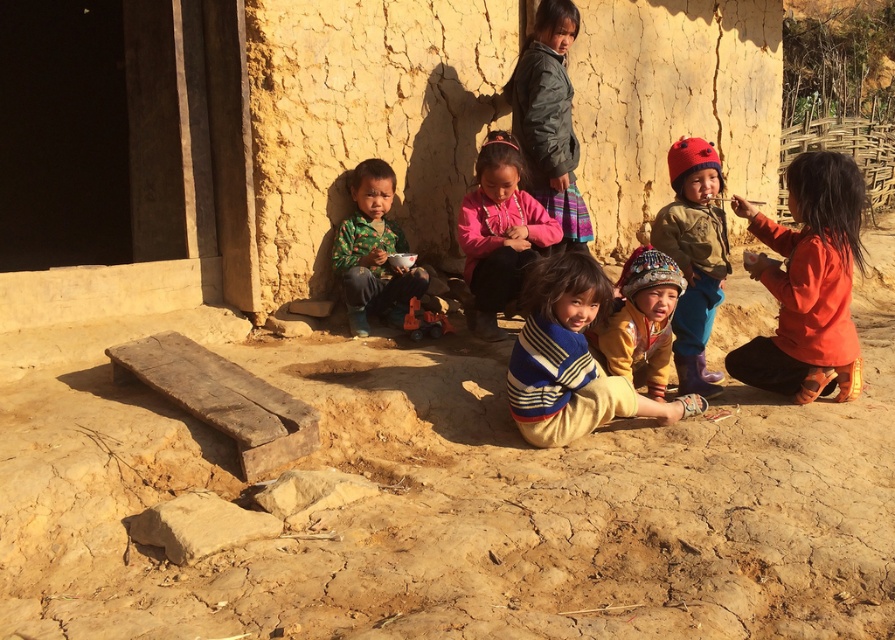
Consider the image. You are a photographer trying to capture the scene of children playing outside a rustic building. You notice a point at coordinates (695, 257). Can you identify what this point corresponds to in the image?

The point at coordinates (695, 257) is on the knitted woolen hat at center.

You are a photographer trying to capture a closeup of the knitted yellow sweater at center without including the brown rough stone at lower left in the frame. Based on their positions, is this possible?

The brown rough stone at lower left is behind the knitted yellow sweater at center, so it is possible to capture a closeup of the knitted yellow sweater at center without including the brown rough stone at lower left in the frame.

You are a photographer trying to capture a group photo of the children wearing the pink fleece jacket at center and the knitted yellow sweater at center. If you want to ensure both children fit in the frame without cropping, which child should you position closer to the camera?

The pink fleece jacket at center is wider than the knitted yellow sweater at center. To ensure both fit in the frame, position the child in the pink fleece jacket at center slightly closer to the camera to reduce its apparent width, while keeping the child in the knitted yellow sweater at center at a farther distance.